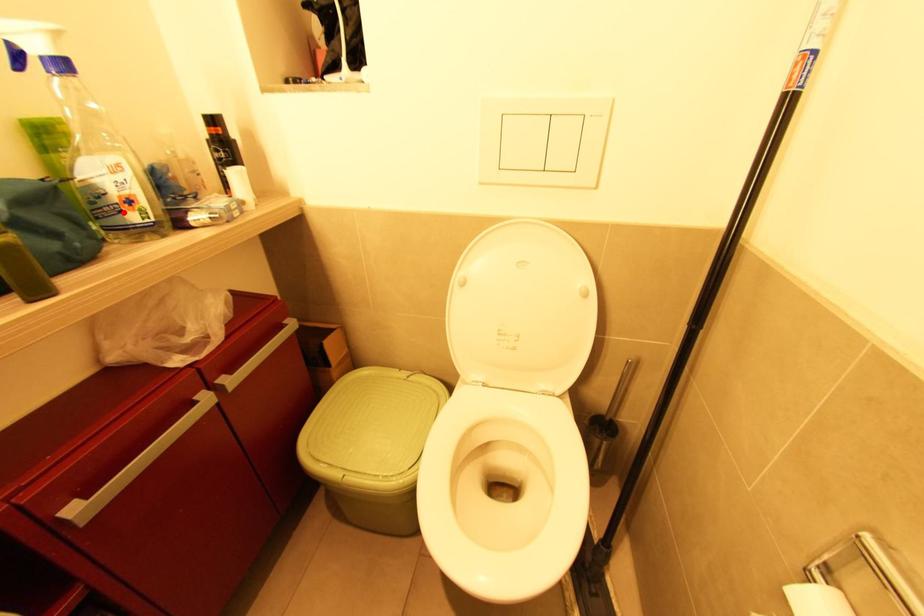
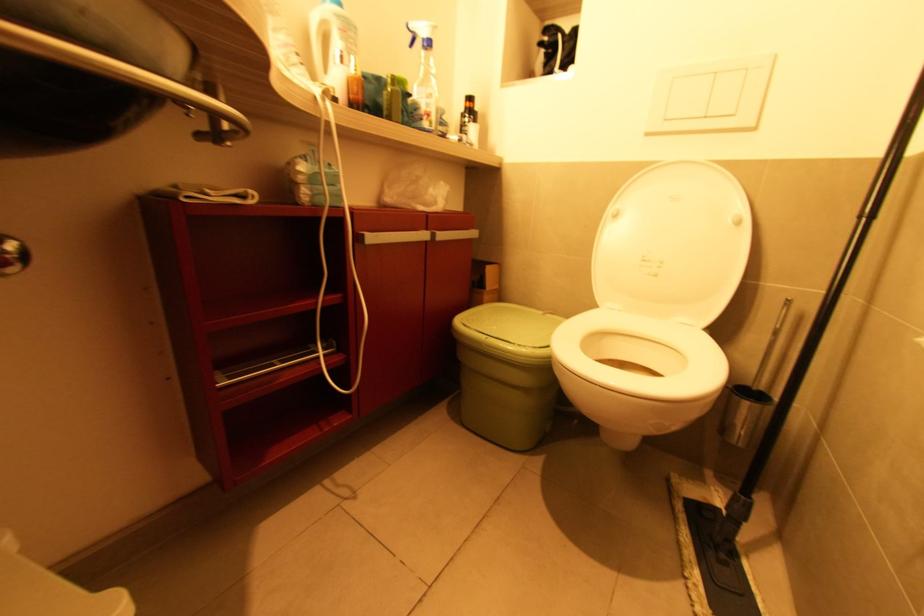
Where in the second image is the point corresponding to the highlighted location from the first image?

(424, 121)